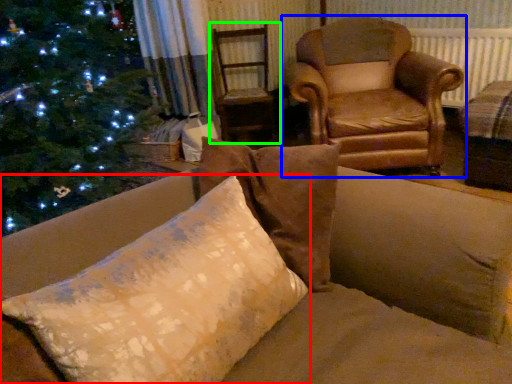
Question: Which object is the closest to the pillow (highlighted by a red box)? Choose among these: chair (highlighted by a blue box) or swivel chair (highlighted by a green box).

Choices:
 (A) chair
 (B) swivel chair

Answer: (A)